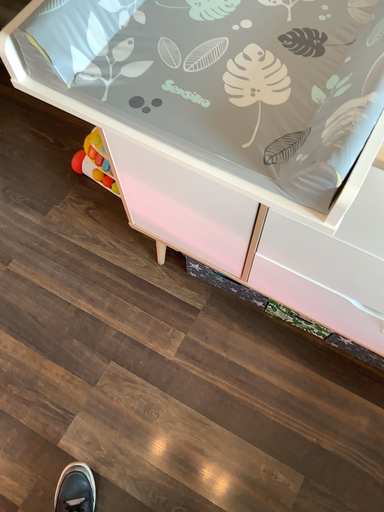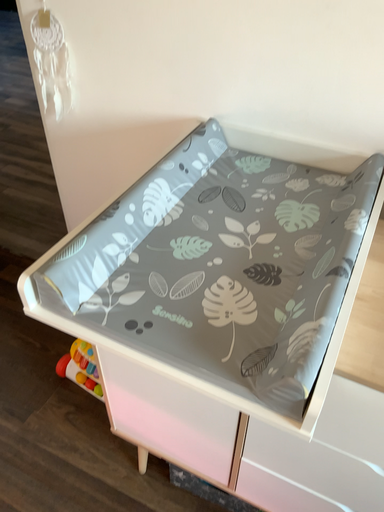
Question: How did the camera likely rotate when shooting the video?

Choices:
 (A) rotated downward
 (B) rotated upward

Answer: (B)